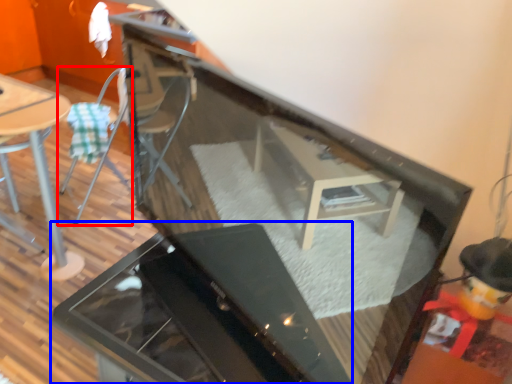
Question: Which object appears closest to the camera in this image, chair (highlighted by a red box) or grill (highlighted by a blue box)?

Choices:
 (A) chair
 (B) grill

Answer: (B)